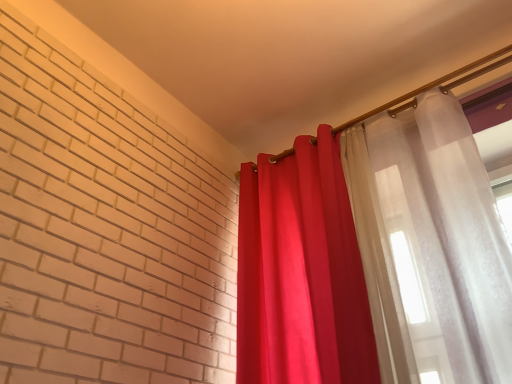
Question: From the image's perspective, is translucent white curtain at upper right, which is the 1th curtain in right-to-left order, positioned above or below matte red curtain at right, the 2th curtain viewed from the right?

Choices:
 (A) below
 (B) above

Answer: (B)

Question: In terms of size, does translucent white curtain at upper right, which is counted as the second curtain, starting from the left, appear bigger or smaller than matte red curtain at right, acting as the first curtain starting from the left?

Choices:
 (A) small
 (B) big

Answer: (A)

Question: Is point (283, 230) closer or farther from the camera than point (315, 148)?

Choices:
 (A) closer
 (B) farther

Answer: (A)

Question: Based on their sizes in the image, would you say matte red curtain at right, acting as the first curtain starting from the left, is bigger or smaller than translucent white curtain at upper right, which is the 1th curtain in right-to-left order?

Choices:
 (A) big
 (B) small

Answer: (A)

Question: Relative to translucent white curtain at upper right, which is the 1th curtain in right-to-left order, is matte red curtain at right, the 2th curtain viewed from the right, in front or behind?

Choices:
 (A) front
 (B) behind

Answer: (B)

Question: Is point (347, 225) positioned closer to the camera than point (435, 168)?

Choices:
 (A) farther
 (B) closer

Answer: (A)

Question: Considering the relative positions of matte red curtain at right, the 2th curtain viewed from the right, and translucent white curtain at upper right, which is counted as the second curtain, starting from the left, in the image provided, is matte red curtain at right, the 2th curtain viewed from the right, to the left or to the right of translucent white curtain at upper right, which is counted as the second curtain, starting from the left,?

Choices:
 (A) right
 (B) left

Answer: (B)